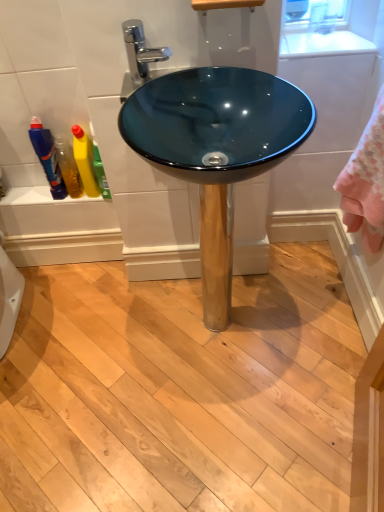
This screenshot has height=512, width=384. In order to click on empty space that is ontop of white glossy countertop at upper center (from a real-world perspective) in this screenshot , I will do `click(345, 25)`.